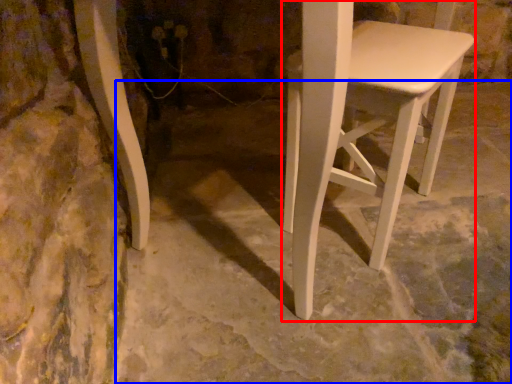
Question: Among these objects, which one is nearest to the camera, stool (highlighted by a red box) or concrete (highlighted by a blue box)?

Choices:
 (A) stool
 (B) concrete

Answer: (B)